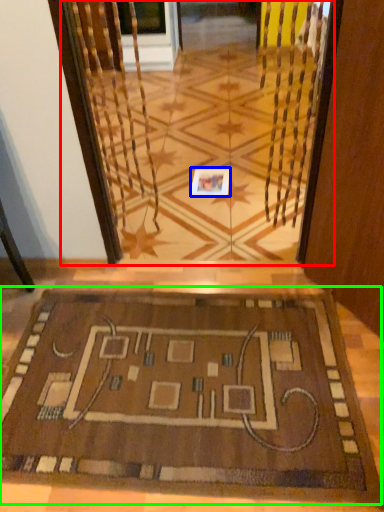
Question: Which is nearer to the glass door (highlighted by a red box)? square (highlighted by a blue box) or mat (highlighted by a green box).

Choices:
 (A) square
 (B) mat

Answer: (A)